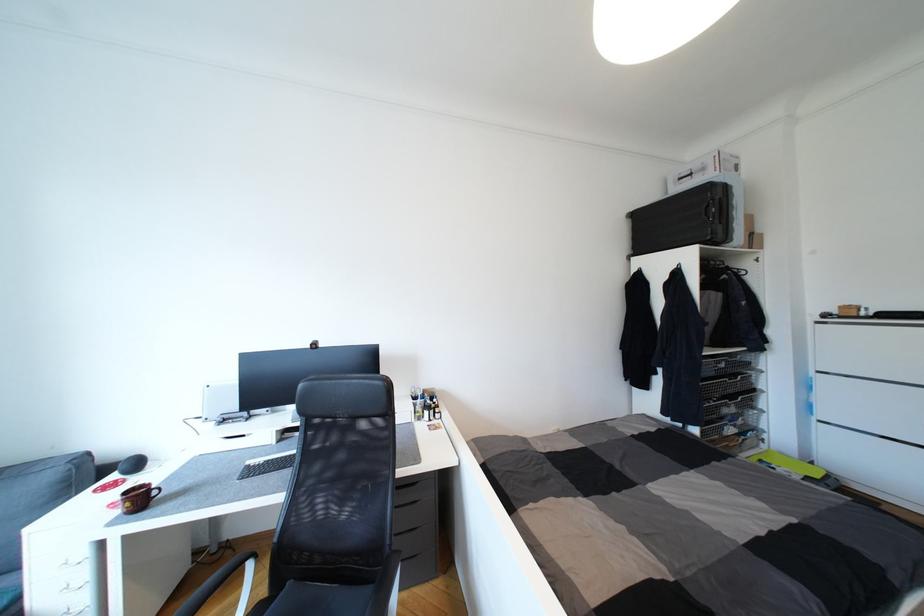
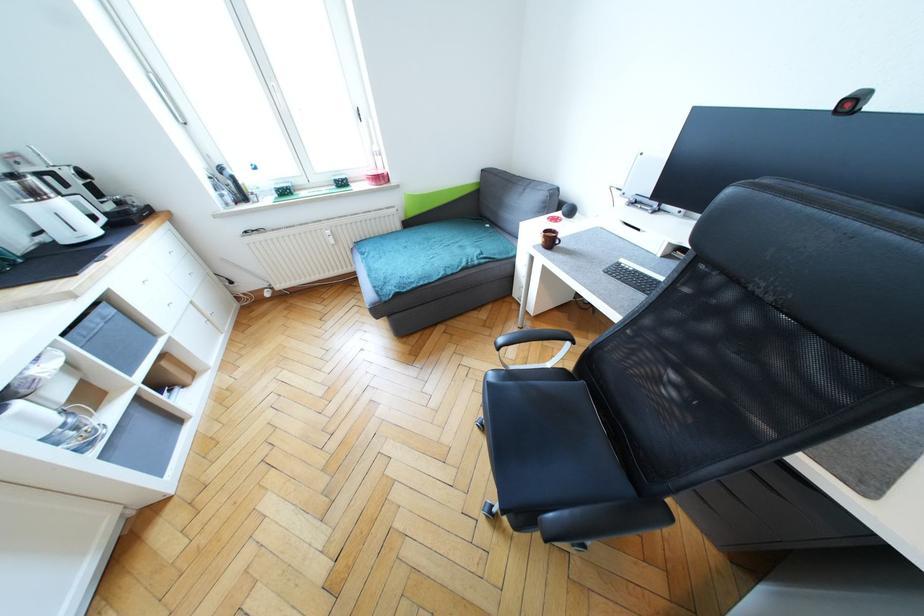
Where in the second image is the point corresponding to (318,346) from the first image?

(857, 103)